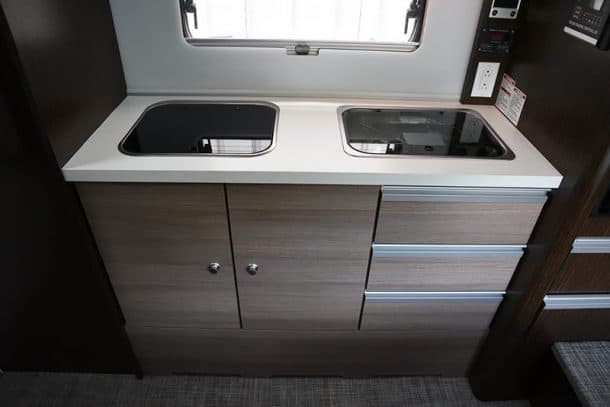
Find the location of a particular element. The height and width of the screenshot is (407, 610). drawer 3 is located at coordinates (440, 214).